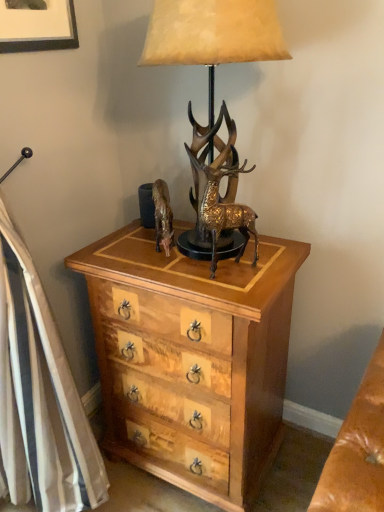
Image resolution: width=384 pixels, height=512 pixels. What are the coordinates of `free space to the left of gold metallic horse at center` in the screenshot? It's located at (121, 249).